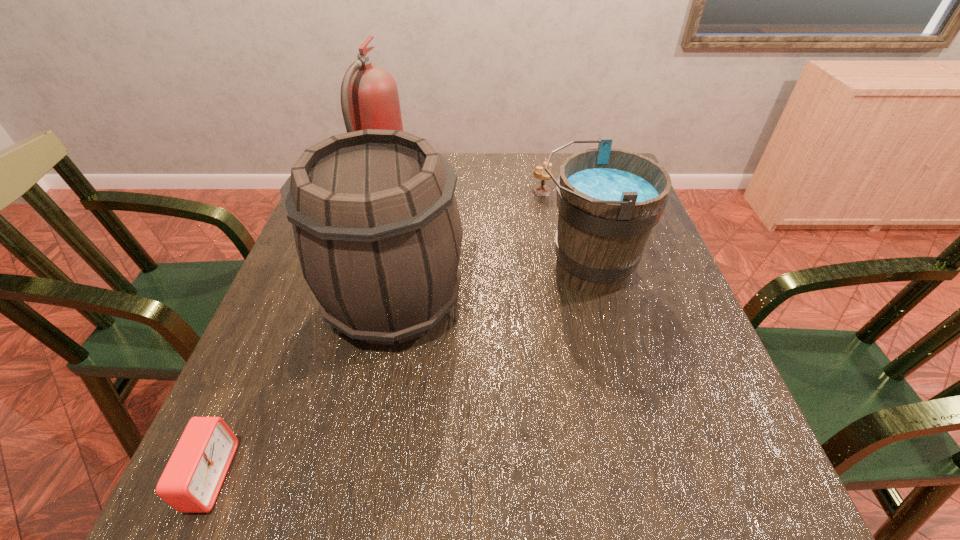
You are a GUI agent. You are given a task and a screenshot of the screen. Output one action in this format:
    pyautogui.click(x=<x>, y=<y>)
    Task: Click on the vacant space situated with a handle on the side of the third tallest object
    The height and width of the screenshot is (540, 960).
    Given the screenshot: What is the action you would take?
    pyautogui.click(x=434, y=268)

Find the location of a particular element. blank space located with a handle on the side of the third tallest object is located at coordinates (403, 268).

I want to click on free space located on the right of the candle holder, so click(x=627, y=191).

Where is `vacant space located on the front-facing side of the alarm clock`? This screenshot has height=540, width=960. vacant space located on the front-facing side of the alarm clock is located at coordinates (390, 476).

Identify the location of fire extinguisher located in the far edge section of the desktop. (369, 96).

Where is `candle holder situated at the far edge`? candle holder situated at the far edge is located at coordinates (541, 190).

Find the location of a particular element. Image resolution: width=960 pixels, height=540 pixels. object present at the near edge is located at coordinates (190, 483).

Identify the location of fire extinguisher positioned at the left edge. Image resolution: width=960 pixels, height=540 pixels. (369, 96).

Find the location of a particular element. wine bucket present at the left edge is located at coordinates (378, 234).

You are a GUI agent. You are given a task and a screenshot of the screen. Output one action in this format:
    pyautogui.click(x=<x>, y=<y>)
    Task: Click on the alarm clock that is at the left edge
    This screenshot has width=960, height=540.
    Given the screenshot: What is the action you would take?
    pyautogui.click(x=190, y=483)